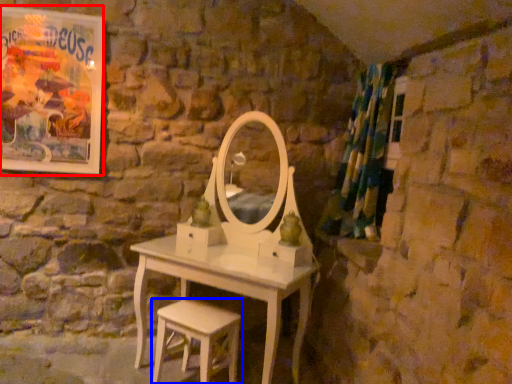
Question: Which of the following is the farthest to the observer, poster page (highlighted by a red box) or stool (highlighted by a blue box)?

Choices:
 (A) poster page
 (B) stool

Answer: (A)